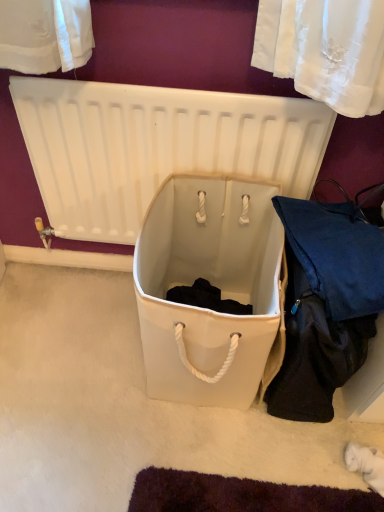
Question: From the image's perspective, is white plastic radiator at center on top of dark blue fabric at lower right?

Choices:
 (A) yes
 (B) no

Answer: (A)

Question: Is dark blue fabric at lower right at the back of white plastic radiator at center?

Choices:
 (A) yes
 (B) no

Answer: (B)

Question: Does white plastic radiator at center lie behind dark blue fabric at lower right?

Choices:
 (A) yes
 (B) no

Answer: (A)

Question: From a real-world perspective, is white plastic radiator at center on top of dark blue fabric at lower right?

Choices:
 (A) no
 (B) yes

Answer: (B)

Question: Is white plastic radiator at center in front of dark blue fabric at lower right?

Choices:
 (A) yes
 (B) no

Answer: (B)

Question: From a real-world perspective, is dark blue fabric at lower right positioned above or below white fabric storage box at center?

Choices:
 (A) below
 (B) above

Answer: (B)

Question: From the image's perspective, is dark blue fabric at lower right above or below white fabric storage box at center?

Choices:
 (A) below
 (B) above

Answer: (A)

Question: Choose the correct answer: Is dark blue fabric at lower right inside white fabric storage box at center or outside it?

Choices:
 (A) inside
 (B) outside

Answer: (B)

Question: Considering the positions of dark blue fabric at lower right and white fabric storage box at center in the image, is dark blue fabric at lower right taller or shorter than white fabric storage box at center?

Choices:
 (A) short
 (B) tall

Answer: (B)

Question: Is white plastic radiator at center to the left or to the right of dark blue fabric at lower right in the image?

Choices:
 (A) left
 (B) right

Answer: (A)

Question: From the image's perspective, relative to dark blue fabric at lower right, is white plastic radiator at center above or below?

Choices:
 (A) below
 (B) above

Answer: (B)

Question: In terms of height, does white plastic radiator at center look taller or shorter compared to dark blue fabric at lower right?

Choices:
 (A) short
 (B) tall

Answer: (B)

Question: Looking at the image, does white plastic radiator at center seem bigger or smaller compared to dark blue fabric at lower right?

Choices:
 (A) big
 (B) small

Answer: (B)

Question: Looking at the image, does dark blue fabric at lower right seem bigger or smaller compared to white plastic radiator at center?

Choices:
 (A) big
 (B) small

Answer: (A)

Question: Considering the positions of point (375, 236) and point (122, 195), is point (375, 236) closer or farther from the camera than point (122, 195)?

Choices:
 (A) farther
 (B) closer

Answer: (B)